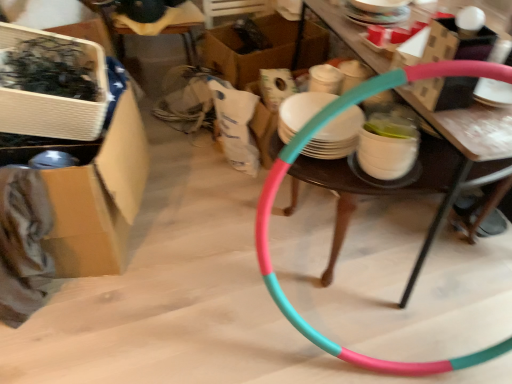
In order to click on free location to the right of cardboard box at left, which is the 2th box in front-to-back order in this screenshot , I will do `click(197, 236)`.